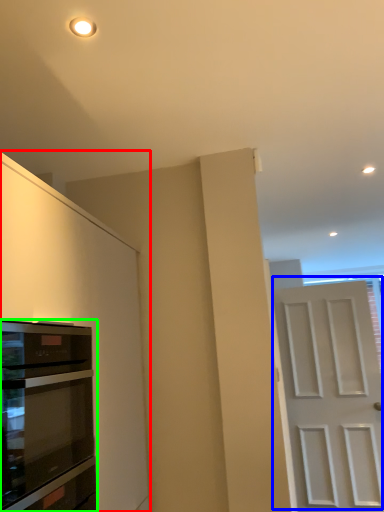
Question: Which object is positioned closest to cabinetry (highlighted by a red box)? Select from door (highlighted by a blue box) and oven (highlighted by a green box).

Choices:
 (A) door
 (B) oven

Answer: (B)